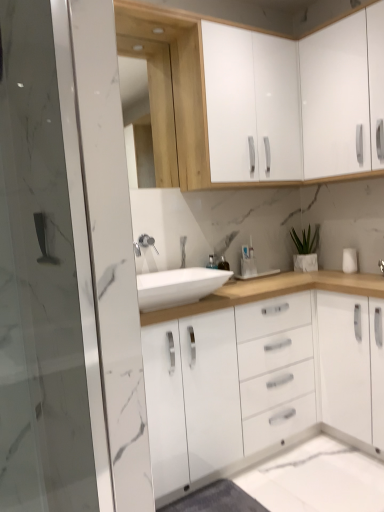
Find the location of `transparent glass screen door at left`. transparent glass screen door at left is located at coordinates (42, 271).

Where is `white glossy cabinet at upper right, acting as the first cabinetry starting from the right`? white glossy cabinet at upper right, acting as the first cabinetry starting from the right is located at coordinates (342, 94).

Measure the distance between white matte plant at upper right and camera.

white matte plant at upper right and camera are 8.26 feet apart from each other.

You are a GUI agent. You are given a task and a screenshot of the screen. Output one action in this format:
    pyautogui.click(x=<x>, y=<y>)
    Task: Click on the white glossy sink at center
    The image size is (384, 512).
    Given the screenshot: What is the action you would take?
    pyautogui.click(x=178, y=287)

What is the approximate height of white glossy cabinet at upper center, the 2th cabinetry in the right-to-left sequence?

white glossy cabinet at upper center, the 2th cabinetry in the right-to-left sequence, is 77.04 centimeters tall.

Find the location of a particular element. This screenshot has height=512, width=384. transparent glass screen door at left is located at coordinates (42, 271).

Is white glossy sink at center a part of natural wood medicine cabinet at upper center?

No, white glossy sink at center is not a part of natural wood medicine cabinet at upper center.

From a real-world perspective, is natural wood medicine cabinet at upper center above or below white glossy sink at center?

In terms of real-world spatial position, natural wood medicine cabinet at upper center is above white glossy sink at center.

In the scene shown: Is natural wood medicine cabinet at upper center to the left or to the right of white glossy sink at center in the image?

In the image, natural wood medicine cabinet at upper center appears on the left side of white glossy sink at center.

Which is behind, point (142, 50) or point (175, 298)?

The point (142, 50) is behind.

From a real-world perspective, is white glossy sink at center physically located above or below white glossy cabinet at upper center, the 2th cabinetry in the right-to-left sequence?

Clearly, from a real-world perspective, white glossy sink at center is below white glossy cabinet at upper center, the 2th cabinetry in the right-to-left sequence.

Is white glossy sink at center next to white glossy cabinet at upper center, the 1th cabinetry in the left-to-right sequence?

They are not placed beside each other.

Is white glossy sink at center taller than white glossy cabinet at upper center, the 2th cabinetry in the right-to-left sequence?

No, white glossy sink at center is not taller than white glossy cabinet at upper center, the 2th cabinetry in the right-to-left sequence.

From a real-world perspective, is white matte plant at upper right located higher than white glossy cabinet at upper center, the 2th cabinetry in the right-to-left sequence?

No, from a real-world perspective, white matte plant at upper right is not on top of white glossy cabinet at upper center, the 2th cabinetry in the right-to-left sequence.

From the image's perspective, is white matte plant at upper right above or below white glossy cabinet at upper center, the 1th cabinetry in the left-to-right sequence?

From the image's perspective, white matte plant at upper right appears below white glossy cabinet at upper center, the 1th cabinetry in the left-to-right sequence.

Which object is wider, white matte plant at upper right or white glossy cabinet at upper center, the 2th cabinetry in the right-to-left sequence?

With larger width is white glossy cabinet at upper center, the 2th cabinetry in the right-to-left sequence.

Would you say white matte plant at upper right is to the left or to the right of white glossy cabinet at upper center, the 1th cabinetry in the left-to-right sequence, in the picture?

white matte plant at upper right is positioned on white glossy cabinet at upper center, the 1th cabinetry in the left-to-right sequence,'s right side.

Considering the relative sizes of white glossy cabinet at upper center, the 1th cabinetry in the left-to-right sequence, and white matte plant at upper right in the image provided, is white glossy cabinet at upper center, the 1th cabinetry in the left-to-right sequence, smaller than white matte plant at upper right?

No, white glossy cabinet at upper center, the 1th cabinetry in the left-to-right sequence, is not smaller than white matte plant at upper right.

How distant is white glossy cabinet at upper center, the 1th cabinetry in the left-to-right sequence, from white matte plant at upper right?

31.96 inches.

Considering the points (223, 127) and (296, 241), which point is behind, point (223, 127) or point (296, 241)?

The point (296, 241) is more distant.

Which object is positioned more to the left, white glossy cabinet at upper center, the 2th cabinetry in the right-to-left sequence, or white matte plant at upper right?

Positioned to the left is white glossy cabinet at upper center, the 2th cabinetry in the right-to-left sequence.

Consider the image. Is natural wood medicine cabinet at upper center completely or partially inside white matte plant at upper right?

That's incorrect, natural wood medicine cabinet at upper center is not inside white matte plant at upper right.

Based on their positions, is white matte plant at upper right located to the left or right of natural wood medicine cabinet at upper center?

white matte plant at upper right is to the right of natural wood medicine cabinet at upper center.

Between white matte plant at upper right and natural wood medicine cabinet at upper center, which one is positioned in front?

natural wood medicine cabinet at upper center is closer to the camera.

At what (x,y) coordinates should I click in order to perform the action: click on medicine cabinet to the left of white matte plant at upper right. Please return your answer as a coordinate pair (x, y). The width and height of the screenshot is (384, 512). Looking at the image, I should click on (157, 105).

Does white matte plant at upper right touch satin nickel faucet at center?

white matte plant at upper right is not next to satin nickel faucet at center, and they're not touching.

Where is `tap to the left of white matte plant at upper right`? Image resolution: width=384 pixels, height=512 pixels. tap to the left of white matte plant at upper right is located at coordinates [x=144, y=244].

From the image's perspective, relative to satin nickel faucet at center, is white matte plant at upper right above or below?

white matte plant at upper right is above satin nickel faucet at center.

From the image's perspective, is white matte plant at upper right located above or below transparent glass screen door at left?

white matte plant at upper right is above transparent glass screen door at left.

Does point (317, 240) appear closer or farther from the camera than point (4, 269)?

Point (317, 240) is positioned farther from the camera compared to point (4, 269).

Which object is positioned more to the left, white matte plant at upper right or transparent glass screen door at left?

transparent glass screen door at left.

Looking at this image, is white matte plant at upper right facing towards transparent glass screen door at left?

No, white matte plant at upper right is not oriented towards transparent glass screen door at left.

The height and width of the screenshot is (512, 384). I want to click on sink to the right of natural wood medicine cabinet at upper center, so click(x=178, y=287).

Find the location of `sink below the white glossy cabinet at upper center, the 2th cabinetry in the right-to-left sequence (from a real-world perspective)`. sink below the white glossy cabinet at upper center, the 2th cabinetry in the right-to-left sequence (from a real-world perspective) is located at coordinates (178, 287).

From the image, which object appears to be farther from white matte plant at upper right, white glossy cabinet at upper center, the 2th cabinetry in the right-to-left sequence, or white glossy cabinet at upper right, acting as the first cabinetry starting from the right?

Based on the image, white glossy cabinet at upper center, the 2th cabinetry in the right-to-left sequence, appears to be further to white matte plant at upper right.

In the scene shown: Based on their spatial positions, is white matte plant at upper right or white glossy cabinet at upper right, which is the second cabinetry from left to right, further from natural wood medicine cabinet at upper center?

white matte plant at upper right is further to natural wood medicine cabinet at upper center.

Considering their positions, is white glossy cabinet at upper right, acting as the first cabinetry starting from the right, positioned closer to natural wood medicine cabinet at upper center than white matte plant at upper right?

Among the two, white glossy cabinet at upper right, acting as the first cabinetry starting from the right, is located nearer to natural wood medicine cabinet at upper center.

Based on their spatial positions, is white glossy sink at center or natural wood medicine cabinet at upper center further from transparent glass screen door at left?

natural wood medicine cabinet at upper center.

Estimate the real-world distances between objects in this image. Which object is closer to white glossy cabinet at upper right, acting as the first cabinetry starting from the right, white glossy cabinet at upper center, the 2th cabinetry in the right-to-left sequence, or white glossy sink at center?

white glossy cabinet at upper center, the 2th cabinetry in the right-to-left sequence, is positioned closer to the anchor white glossy cabinet at upper right, acting as the first cabinetry starting from the right.

Which object lies further to the anchor point white glossy sink at center, white glossy cabinet at upper center, the 2th cabinetry in the right-to-left sequence, or white glossy cabinet at upper right, acting as the first cabinetry starting from the right?

The object further to white glossy sink at center is white glossy cabinet at upper right, acting as the first cabinetry starting from the right.

From the image, which object appears to be nearer to white matte plant at upper right, transparent glass screen door at left or white glossy sink at center?

white glossy sink at center is closer to white matte plant at upper right.

When comparing their distances from natural wood medicine cabinet at upper center, does white glossy cabinet at upper right, acting as the first cabinetry starting from the right, or white glossy sink at center seem closer?

Among the two, white glossy sink at center is located nearer to natural wood medicine cabinet at upper center.

Locate an element on the screen. The height and width of the screenshot is (512, 384). cabinetry situated between natural wood medicine cabinet at upper center and white matte plant at upper right from left to right is located at coordinates (251, 104).

Image resolution: width=384 pixels, height=512 pixels. In order to click on sink between satin nickel faucet at center and white glossy cabinet at upper right, which is the second cabinetry from left to right, from left to right in this screenshot , I will do `click(178, 287)`.

The width and height of the screenshot is (384, 512). I want to click on plant between natural wood medicine cabinet at upper center and white glossy cabinet at upper right, which is the second cabinetry from left to right, in the horizontal direction, so click(x=305, y=241).

Where is `sink between transparent glass screen door at left and satin nickel faucet at center in the front-back direction`? The image size is (384, 512). sink between transparent glass screen door at left and satin nickel faucet at center in the front-back direction is located at coordinates (178, 287).